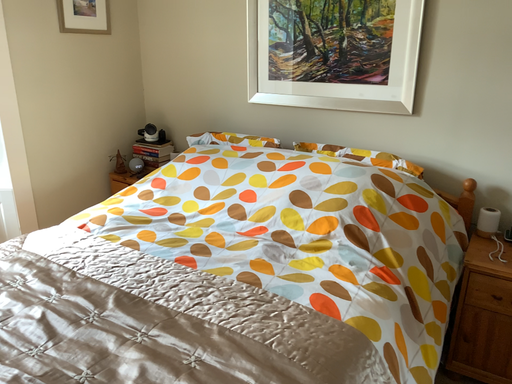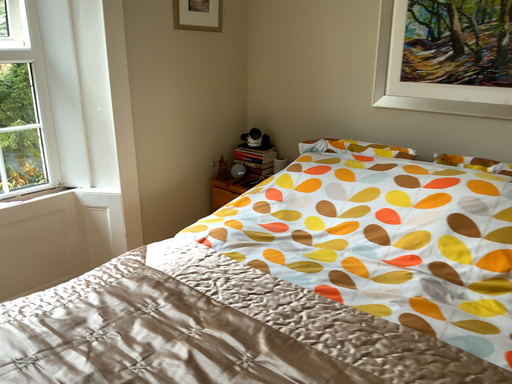
Question: Which way did the camera rotate in the video?

Choices:
 (A) rotated right
 (B) rotated left

Answer: (B)